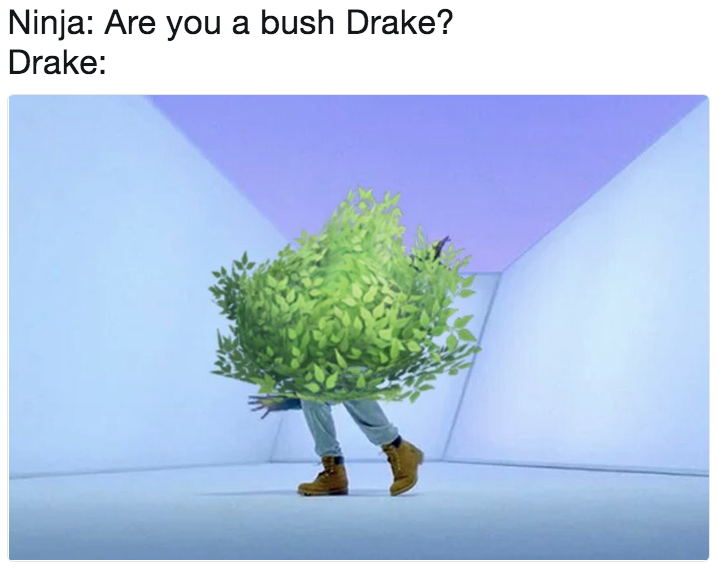
The image size is (722, 573). I want to click on light blue walls, so click(x=152, y=336), click(x=430, y=398), click(x=569, y=395).